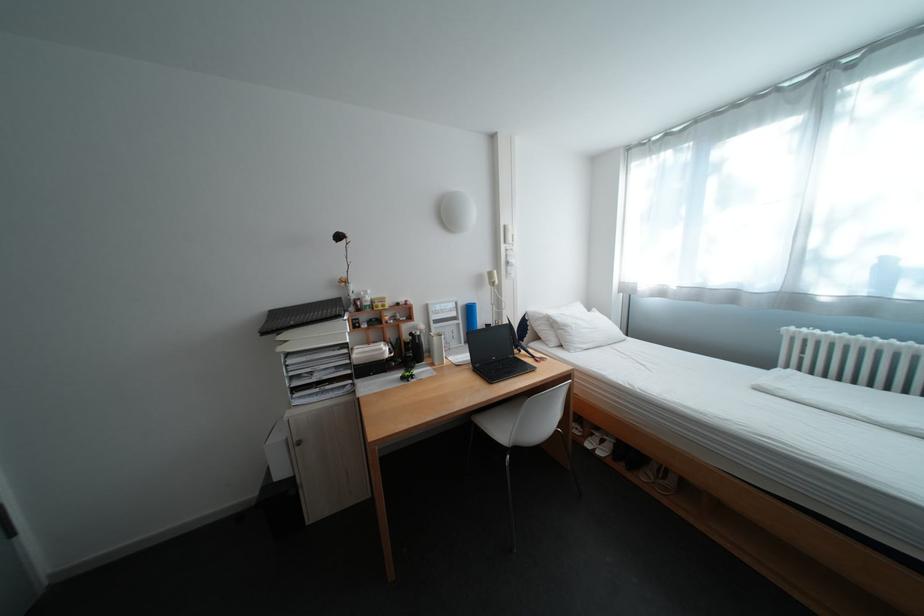
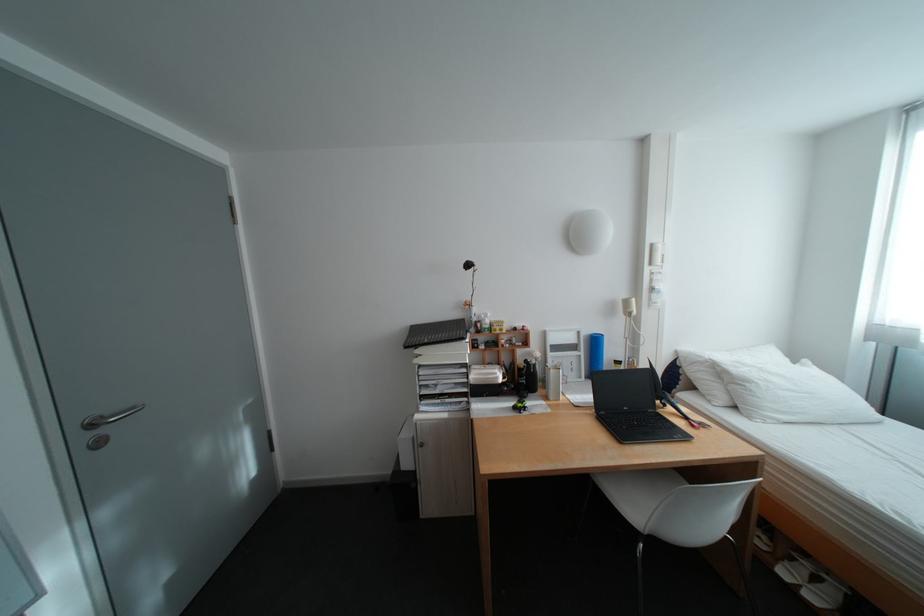
The point at (609, 450) is marked in the first image. Where is the corresponding point in the second image?

(813, 586)